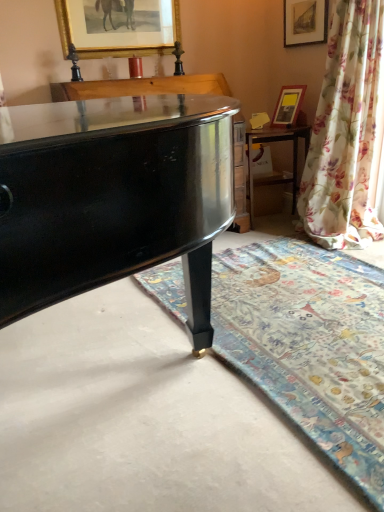
Identify the location of space that is in front of floral fabric curtain at right. (331, 266).